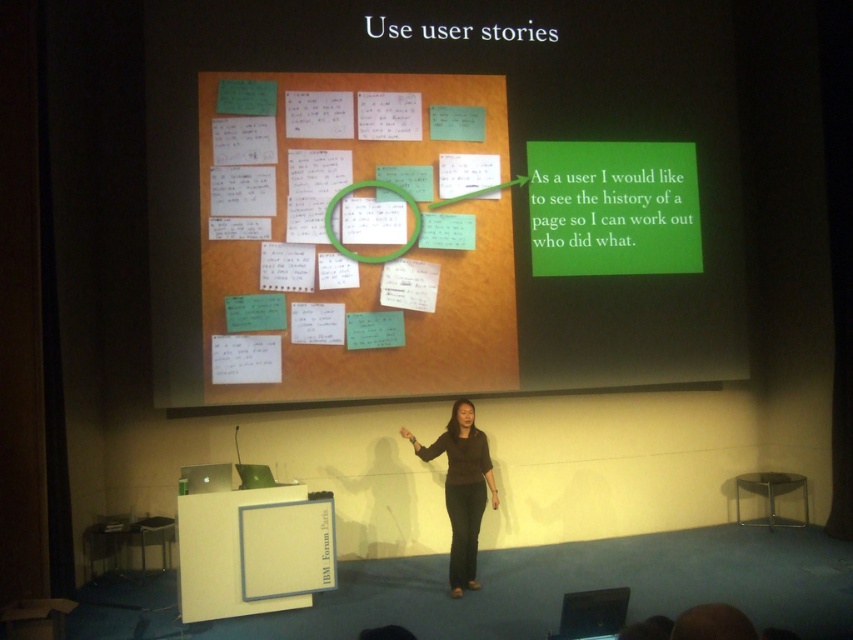
Question: Which of the following is the closest to the observer?

Choices:
 (A) (561, 198)
 (B) (399, 195)
 (C) (267, 388)
 (D) (401, 428)

Answer: (C)

Question: Is green paper notes at center further to camera compared to brown fabric pants at lower center?

Choices:
 (A) no
 (B) yes

Answer: (B)

Question: Which object is closer to the camera taking this photo?

Choices:
 (A) white paper at upper center
 (B) green paper notes at center
 (C) brown fabric pants at lower center

Answer: (C)

Question: Is white paper at upper center to the left of green plastic magnifying glass at upper center from the viewer's perspective?

Choices:
 (A) no
 (B) yes

Answer: (A)

Question: Is brown fabric pants at lower center below green plastic magnifying glass at upper center?

Choices:
 (A) yes
 (B) no

Answer: (A)

Question: Which point is farther to the camera?

Choices:
 (A) (451, 502)
 (B) (393, 193)

Answer: (B)